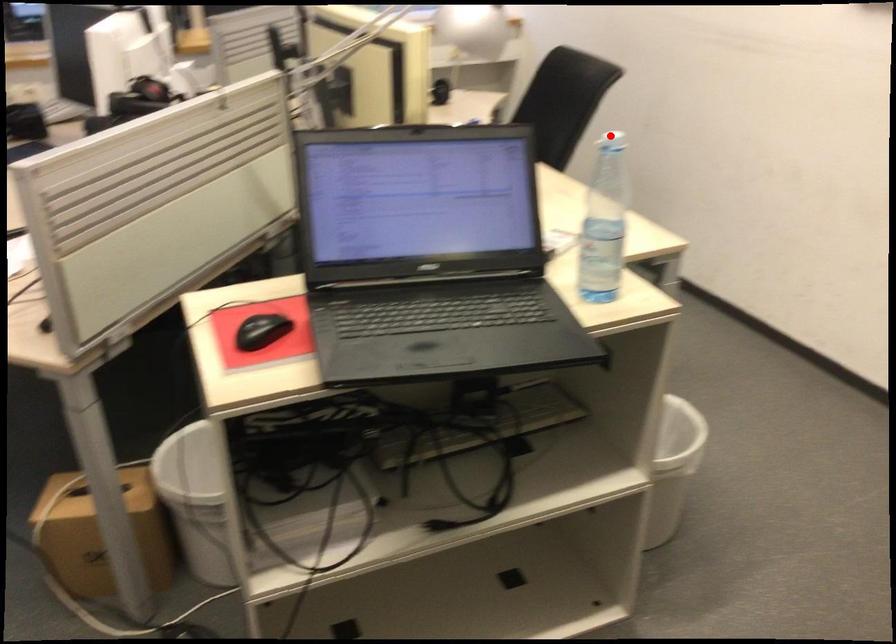
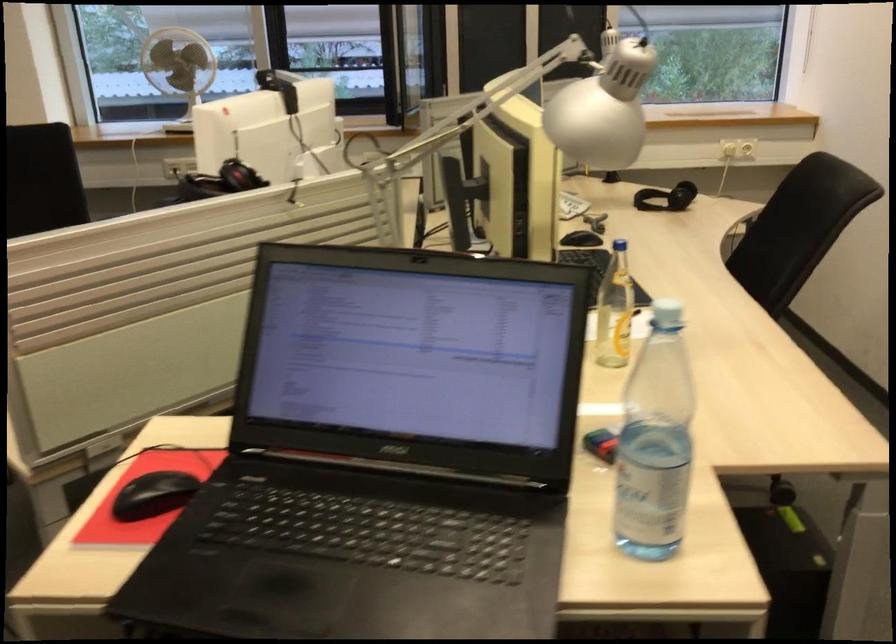
The point at the highlighted location is marked in the first image. Where is the corresponding point in the second image?

(666, 313)